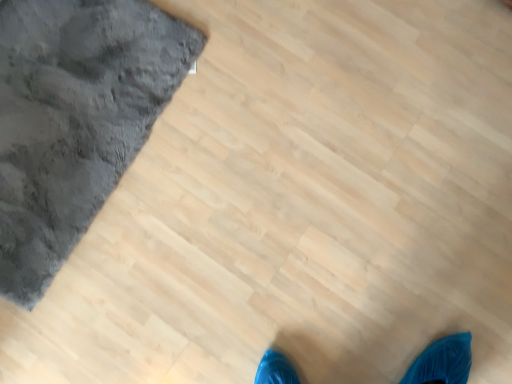
This screenshot has height=384, width=512. I want to click on vacant area that is in front of dark gray plush bath mat at upper left, so click(x=129, y=306).